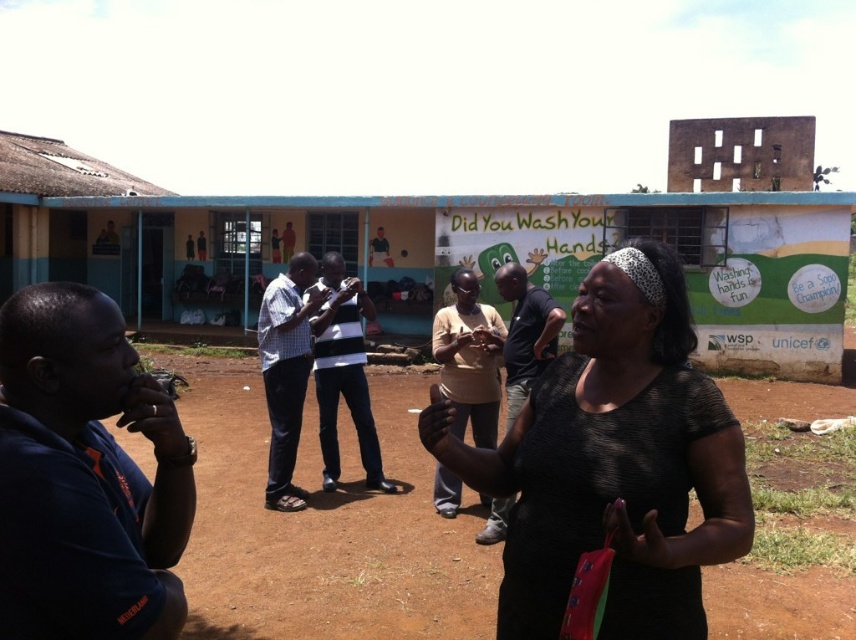
Which is below, dark blue shirt at left or light brown cotton shirt at center?

Positioned lower is dark blue shirt at left.

Does dark blue shirt at left have a greater width compared to light brown cotton shirt at center?

Incorrect, dark blue shirt at left's width does not surpass light brown cotton shirt at center's.

Is point (108, 540) positioned before point (438, 333)?

Yes, point (108, 540) is in front of point (438, 333).

This screenshot has height=640, width=856. Identify the location of dark blue shirt at left. (85, 476).

Identify the location of light brown cotton shirt at center. This screenshot has height=640, width=856. (468, 358).

Describe the element at coordinates (468, 358) in the screenshot. I see `light brown cotton shirt at center` at that location.

At what (x,y) coordinates should I click in order to perform the action: click on light brown cotton shirt at center. Please return your answer as a coordinate pair (x, y). Looking at the image, I should click on (468, 358).

Which is in front, point (632, 291) or point (331, 458)?

Point (632, 291) is in front.

What are the coordinates of `textured black shirt at center` in the screenshot? It's located at (613, 461).